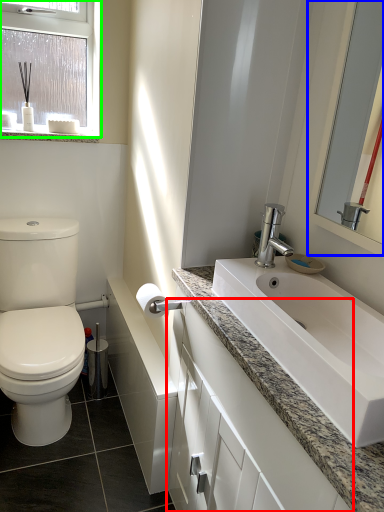
Question: Which object is positioned closest to bathroom cabinet (highlighted by a red box)? Select from mirror (highlighted by a blue box) and window (highlighted by a green box).

Choices:
 (A) mirror
 (B) window

Answer: (A)